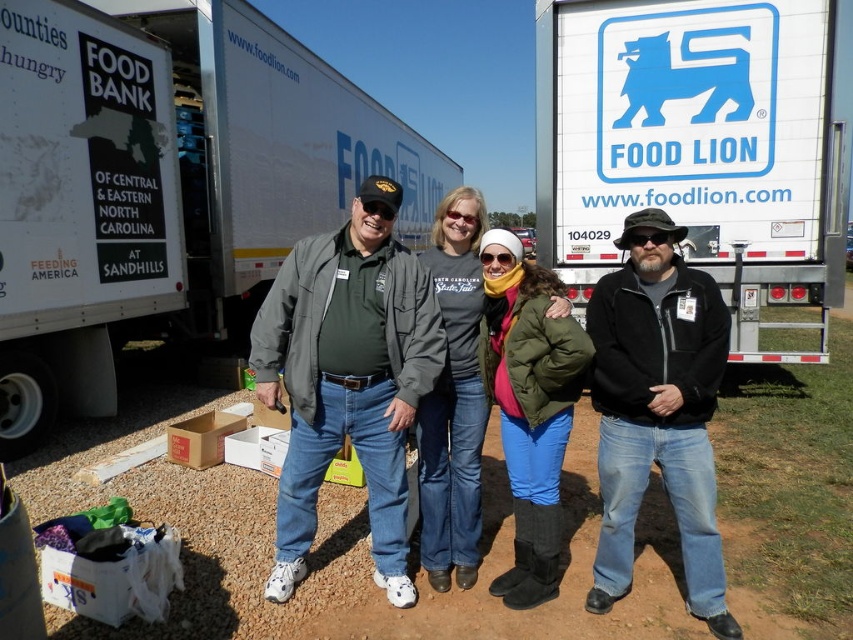
You are a photographer standing behind the group of people in front of the Food Lion and Feeding America trucks. You want to capture a photo where both the matte gray jacket at center and the green puffy jacket at center are clearly visible. Given that your camera has a minimum focus distance of 24 inches, will you be able to take the photo without moving closer?

The distance between the matte gray jacket at center and green puffy jacket at center is 23.81 inches. Since this is just under the camera minimum focus distance of 24 inches, the photographer will need to move slightly closer to ensure both jackets are in focus and visible.